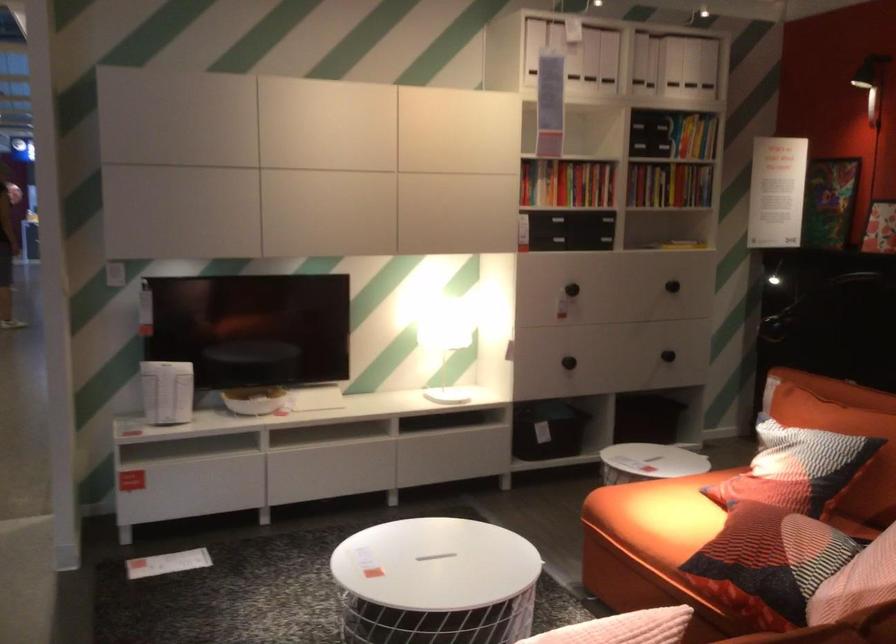
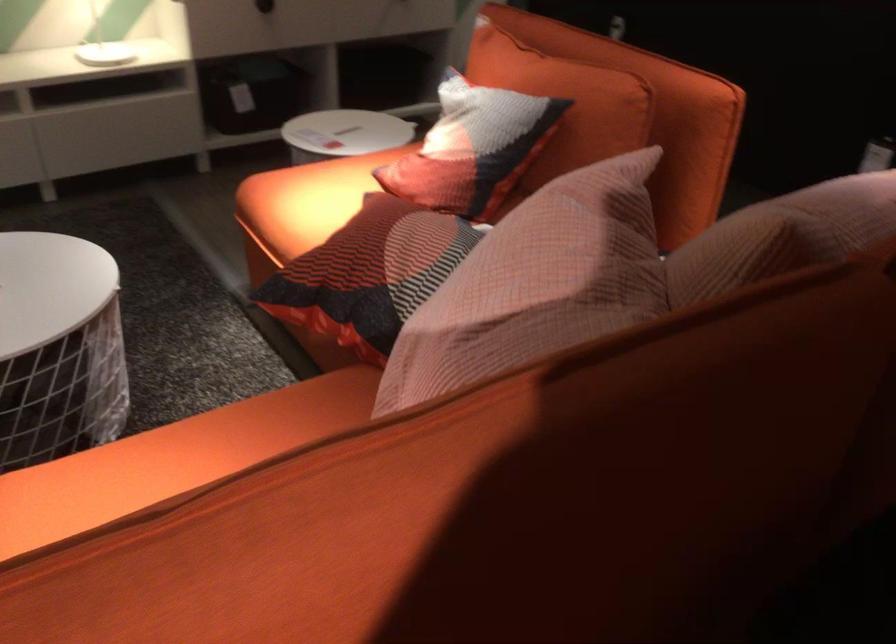
Where in the second image is the point corresponding to point 653,509 from the first image?

(306, 200)